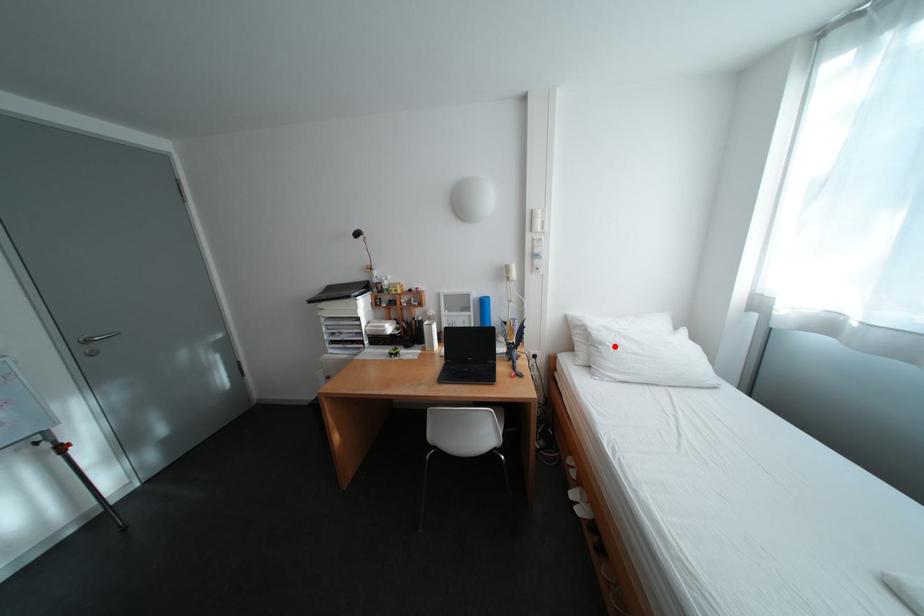
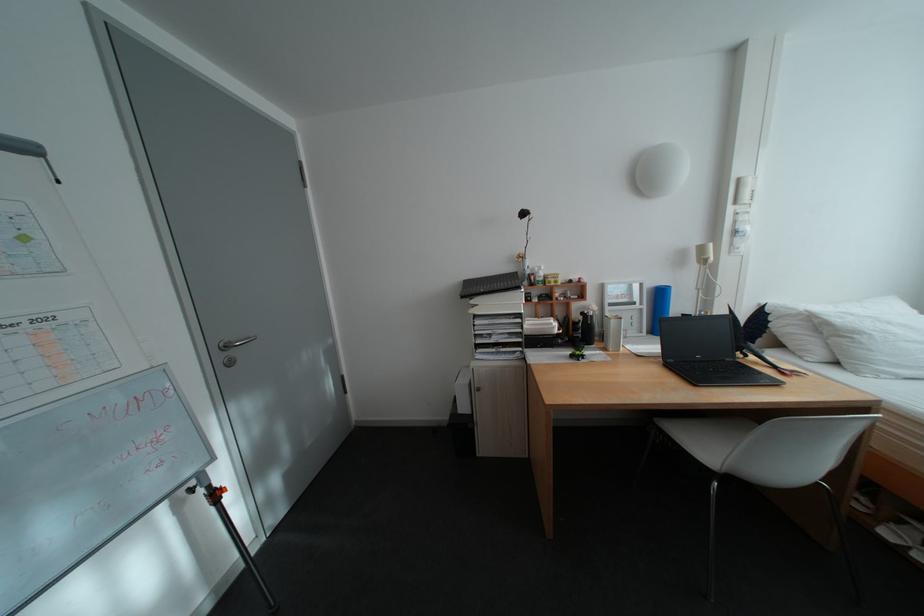
Find the pixel in the second image that matches the highlighted location in the first image.

(871, 334)